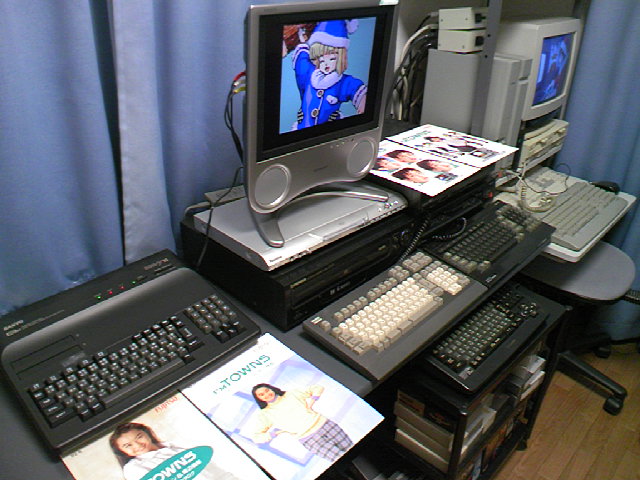
Identify the location of magazines. The width and height of the screenshot is (640, 480). (445, 141), (426, 158), (243, 401), (169, 439).